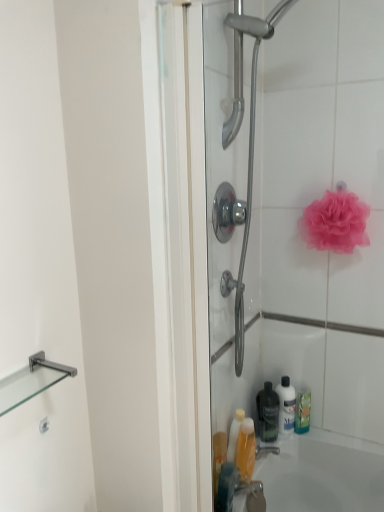
Question: Is green matte bottle at lower right, positioned as the first cleaning product in right-to-left order, behind transparent glass shower door at center?

Choices:
 (A) no
 (B) yes

Answer: (B)

Question: From the image's perspective, is green matte bottle at lower right, which is counted as the second cleaning product, starting from the back, on top of transparent glass shower door at center?

Choices:
 (A) yes
 (B) no

Answer: (B)

Question: Are green matte bottle at lower right, the 2th cleaning product when ordered from front to back, and transparent glass shower door at center located far from each other?

Choices:
 (A) yes
 (B) no

Answer: (B)

Question: Is transparent glass shower door at center located within green matte bottle at lower right, which ranks as the third cleaning product in left-to-right order?

Choices:
 (A) no
 (B) yes

Answer: (A)

Question: Are green matte bottle at lower right, positioned as the first cleaning product in right-to-left order, and transparent glass shower door at center beside each other?

Choices:
 (A) no
 (B) yes

Answer: (A)

Question: Considering the relative sizes of green matte bottle at lower right, which is counted as the second cleaning product, starting from the back, and transparent glass shower door at center in the image provided, is green matte bottle at lower right, which is counted as the second cleaning product, starting from the back, smaller than transparent glass shower door at center?

Choices:
 (A) no
 (B) yes

Answer: (B)

Question: From a real-world perspective, does translucent plastic bottle at lower right, positioned as the first cleaning product in back-to-front order, stand above pink mesh sponge at upper right?

Choices:
 (A) yes
 (B) no

Answer: (B)

Question: Can you confirm if translucent plastic bottle at lower right, which ranks as the second cleaning product in right-to-left order, is smaller than pink mesh sponge at upper right?

Choices:
 (A) no
 (B) yes

Answer: (B)

Question: Does translucent plastic bottle at lower right, positioned as the first cleaning product in back-to-front order, have a greater width compared to pink mesh sponge at upper right?

Choices:
 (A) yes
 (B) no

Answer: (B)

Question: Is translucent plastic bottle at lower right, which is the 2th cleaning product from left to right, oriented away from pink mesh sponge at upper right?

Choices:
 (A) no
 (B) yes

Answer: (A)

Question: Does translucent plastic bottle at lower right, acting as the third cleaning product starting from the front, contain pink mesh sponge at upper right?

Choices:
 (A) yes
 (B) no

Answer: (B)

Question: From the image's perspective, is translucent plastic bottle at lower right, acting as the third cleaning product starting from the front, beneath pink mesh sponge at upper right?

Choices:
 (A) yes
 (B) no

Answer: (A)

Question: Does black matte bottle at lower center touch pink mesh sponge at upper right?

Choices:
 (A) no
 (B) yes

Answer: (A)